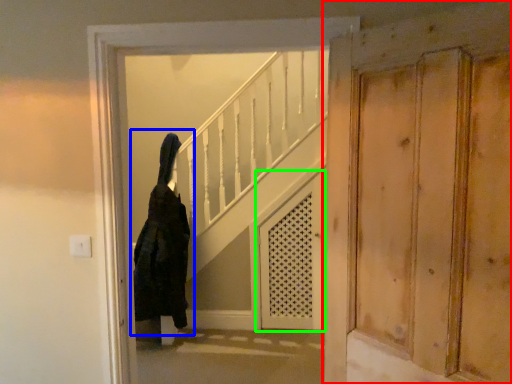
Question: Estimate the real-world distances between objects in this image. Which object is closer to door (highlighted by a red box), woman (highlighted by a blue box) or screen door (highlighted by a green box)?

Choices:
 (A) woman
 (B) screen door

Answer: (B)